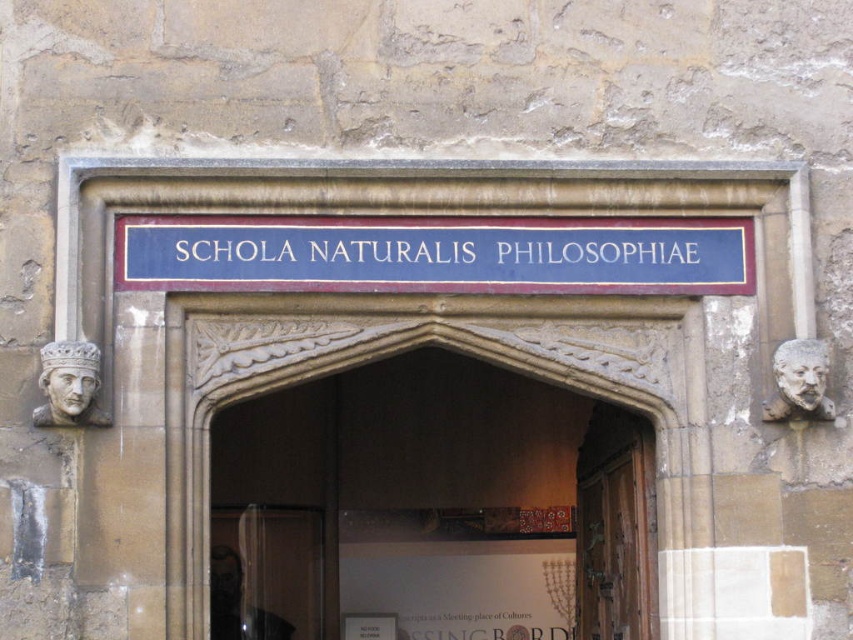
Question: Does carved stone archway at center come in front of wooden at center?

Choices:
 (A) no
 (B) yes

Answer: (B)

Question: Among these objects, which one is nearest to the camera?

Choices:
 (A) wooden at center
 (B) carved stone archway at center
 (C) blue painted wood sign at center

Answer: (B)

Question: Which of the following is the farthest from the observer?

Choices:
 (A) wooden at center
 (B) blue painted wood sign at center
 (C) carved stone archway at center

Answer: (A)

Question: Which of the following is the farthest from the observer?

Choices:
 (A) (439, 323)
 (B) (427, 225)

Answer: (A)

Question: Does blue painted wood sign at center come in front of wooden at center?

Choices:
 (A) yes
 (B) no

Answer: (A)

Question: Can you confirm if blue painted wood sign at center is positioned above wooden at center?

Choices:
 (A) no
 (B) yes

Answer: (B)